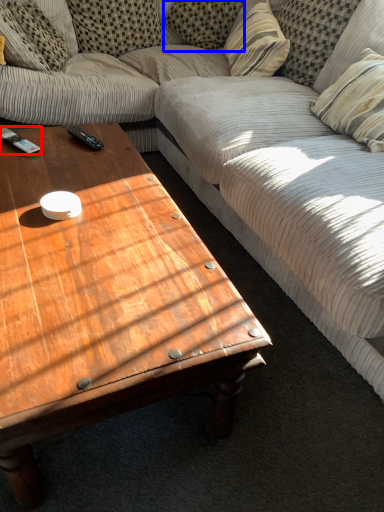
Question: Which object is further to the camera taking this photo, remote control (highlighted by a red box) or pillow (highlighted by a blue box)?

Choices:
 (A) remote control
 (B) pillow

Answer: (B)